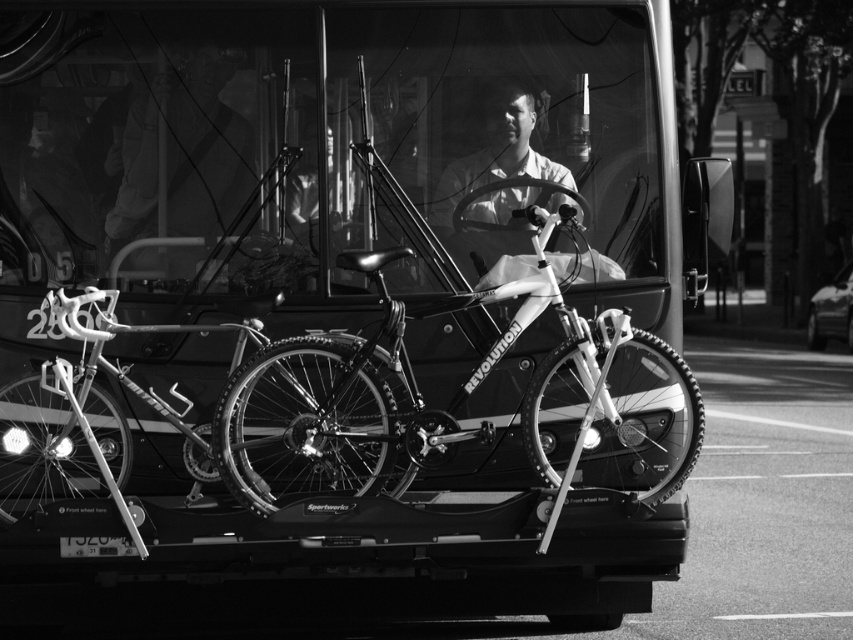
Can you confirm if metallic silver bicycle at center is positioned to the left of shiny silver bicycle at center?

No, metallic silver bicycle at center is not to the left of shiny silver bicycle at center.

Looking at this image, who is positioned more to the left, metallic silver bicycle at center or shiny silver bicycle at center?

shiny silver bicycle at center

At what (x,y) coordinates should I click in order to perform the action: click on metallic silver bicycle at center. Please return your answer as a coordinate pair (x, y). This screenshot has width=853, height=640. Looking at the image, I should click on (329, 156).

Is shiny silver bicycle at center to the left of smooth white shirt at center from the viewer's perspective?

Correct, you'll find shiny silver bicycle at center to the left of smooth white shirt at center.

Can you confirm if shiny silver bicycle at center is positioned to the right of smooth white shirt at center?

Incorrect, shiny silver bicycle at center is not on the right side of smooth white shirt at center.

Which is behind, point (334, 472) or point (519, 104)?

The point (519, 104) is more distant.

The image size is (853, 640). What are the coordinates of `shiny silver bicycle at center` in the screenshot? It's located at (148, 406).

Between metallic silver bicycle at center and shiny metallic bicycle at center, which one has less height?

With less height is shiny metallic bicycle at center.

Can you confirm if metallic silver bicycle at center is bigger than shiny metallic bicycle at center?

Correct, metallic silver bicycle at center is larger in size than shiny metallic bicycle at center.

Locate an element on the screen. The image size is (853, 640). metallic silver bicycle at center is located at coordinates click(329, 156).